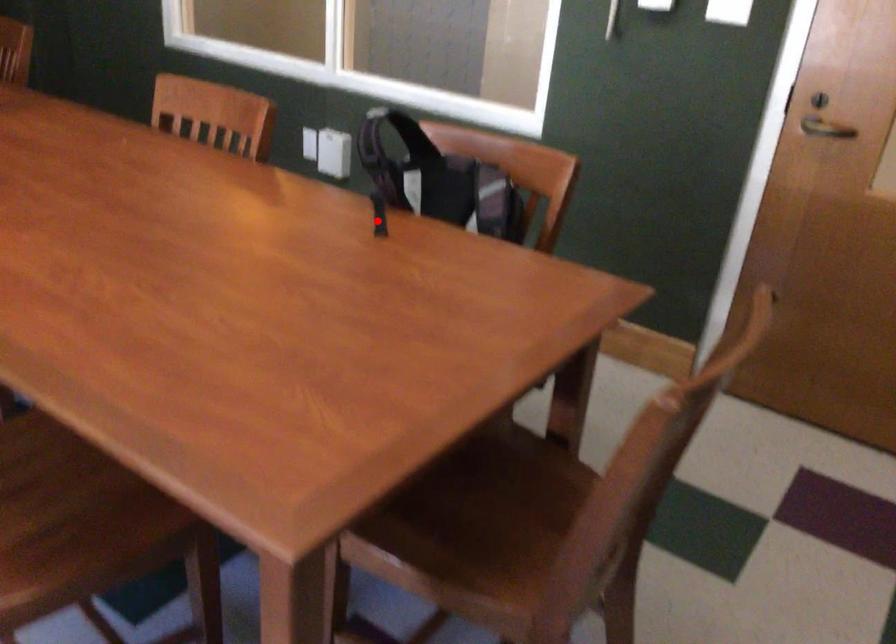
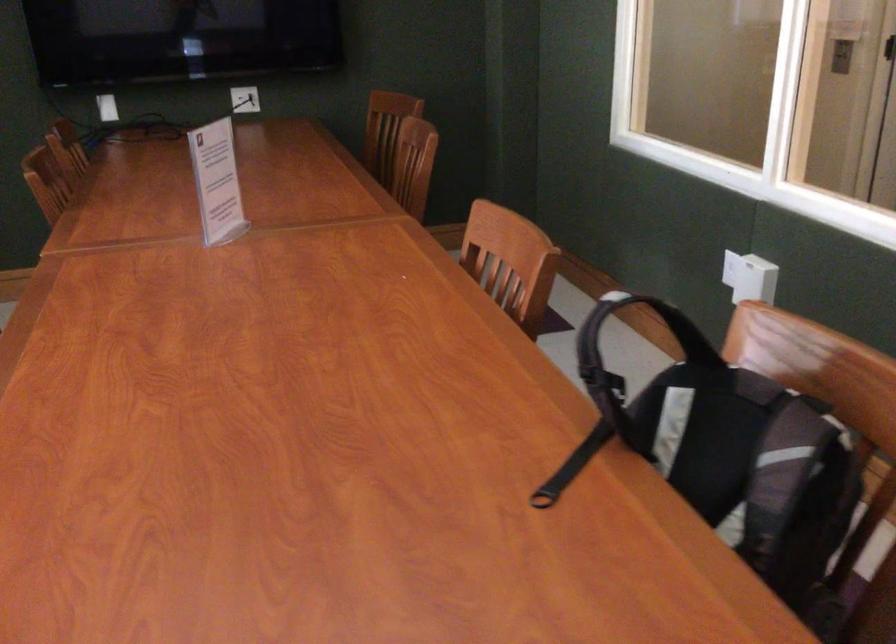
Find the pixel in the second image that matches the highlighted location in the first image.

(572, 466)